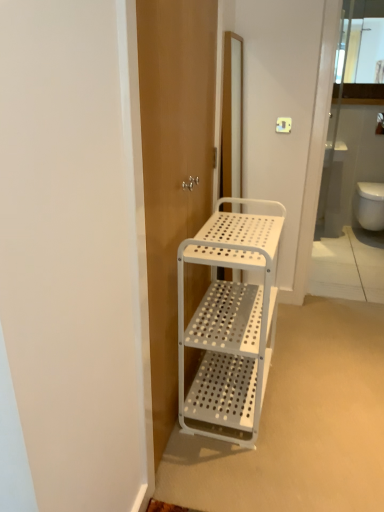
Question: Does white perforated metal cart at center have a smaller size compared to white perforated cabinet at upper center?

Choices:
 (A) yes
 (B) no

Answer: (B)

Question: Is white perforated metal cart at center directly adjacent to white perforated cabinet at upper center?

Choices:
 (A) no
 (B) yes

Answer: (A)

Question: Is the position of white perforated metal cart at center more distant than that of white perforated cabinet at upper center?

Choices:
 (A) no
 (B) yes

Answer: (A)

Question: Is white perforated metal cart at center outside white perforated cabinet at upper center?

Choices:
 (A) no
 (B) yes

Answer: (B)

Question: Does white perforated metal cart at center have a greater height compared to white perforated cabinet at upper center?

Choices:
 (A) no
 (B) yes

Answer: (B)

Question: Considering the positions of white perforated metal cart at center and white perforated cabinet at upper center in the image, is white perforated metal cart at center bigger or smaller than white perforated cabinet at upper center?

Choices:
 (A) big
 (B) small

Answer: (A)

Question: In terms of width, does white perforated metal cart at center look wider or thinner when compared to white perforated cabinet at upper center?

Choices:
 (A) thin
 (B) wide

Answer: (B)

Question: Does point (271, 342) appear closer or farther from the camera than point (357, 17)?

Choices:
 (A) closer
 (B) farther

Answer: (A)

Question: Is white perforated metal cart at center situated inside white perforated cabinet at upper center or outside?

Choices:
 (A) inside
 (B) outside

Answer: (B)

Question: In terms of size, does white perforated metal cart at center appear bigger or smaller than white perforated screen door at center?

Choices:
 (A) small
 (B) big

Answer: (B)

Question: Is white perforated metal cart at center situated inside white perforated screen door at center or outside?

Choices:
 (A) outside
 (B) inside

Answer: (A)

Question: Considering the positions of white perforated metal cart at center and white perforated screen door at center in the image, is white perforated metal cart at center wider or thinner than white perforated screen door at center?

Choices:
 (A) thin
 (B) wide

Answer: (B)

Question: From a real-world perspective, relative to white perforated screen door at center, is white perforated metal cart at center vertically above or below?

Choices:
 (A) below
 (B) above

Answer: (A)

Question: From a real-world perspective, relative to white perforated metal cart at center, is white perforated cabinet at upper center vertically above or below?

Choices:
 (A) below
 (B) above

Answer: (B)

Question: Based on their positions, is white perforated cabinet at upper center located to the left or right of white perforated metal cart at center?

Choices:
 (A) right
 (B) left

Answer: (A)